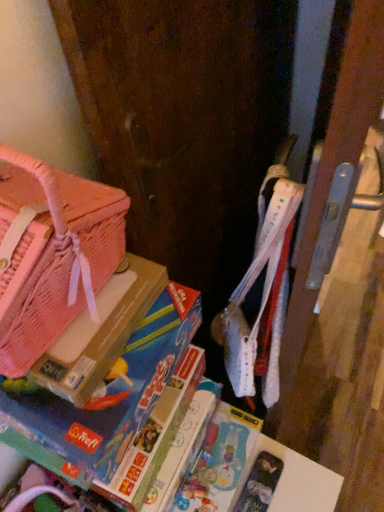
What do you see at coordinates (100, 332) in the screenshot? I see `pink mesh bag at left` at bounding box center [100, 332].

The height and width of the screenshot is (512, 384). Identify the location of pink woven handbag at left. (61, 256).

This screenshot has height=512, width=384. I want to click on pink mesh bag at left, so click(100, 332).

Which point is more forward, (26, 335) or (117, 280)?

The point (26, 335) is more forward.

Is pink woven handbag at left oriented towards pink mesh bag at left?

No, pink woven handbag at left is not oriented towards pink mesh bag at left.

Considering the relative sizes of pink woven handbag at left and pink mesh bag at left in the image provided, is pink woven handbag at left taller than pink mesh bag at left?

Yes, pink woven handbag at left is taller than pink mesh bag at left.

From the image's perspective, relative to pink mesh bag at left, is pink woven handbag at left above or below?

From the image's perspective, pink woven handbag at left appears above pink mesh bag at left.

From the image's perspective, is pink woven handbag at left beneath blue cardboard game at left?

No, from the image's perspective, pink woven handbag at left is not below blue cardboard game at left.

Considering the relative sizes of pink woven handbag at left and blue cardboard game at left in the image provided, is pink woven handbag at left smaller than blue cardboard game at left?

No, pink woven handbag at left is not smaller than blue cardboard game at left.

Is pink woven handbag at left taller or shorter than blue cardboard game at left?

Clearly, pink woven handbag at left is taller compared to blue cardboard game at left.

Can you confirm if pink woven handbag at left is wider than blue cardboard game at left?

Incorrect, the width of pink woven handbag at left does not surpass that of blue cardboard game at left.

Can you confirm if blue cardboard game at left is wider than pink woven handbag at left?

Yes, blue cardboard game at left is wider than pink woven handbag at left.

From a real-world perspective, between blue cardboard game at left and pink woven handbag at left, who is vertically lower?

blue cardboard game at left, from a real-world perspective.

Considering the relative positions of blue cardboard game at left and pink woven handbag at left in the image provided, is blue cardboard game at left to the right of pink woven handbag at left from the viewer's perspective?

Yes.

Based on their sizes in the image, would you say pink mesh bag at left is bigger or smaller than blue cardboard game at left?

In the image, pink mesh bag at left appears to be smaller than blue cardboard game at left.

From a real-world perspective, is pink mesh bag at left positioned above or below blue cardboard game at left?

pink mesh bag at left is above blue cardboard game at left.

In the scene shown: From the image's perspective, would you say pink mesh bag at left is positioned over blue cardboard game at left?

Yes, from the image's perspective, pink mesh bag at left is above blue cardboard game at left.

Is pink mesh bag at left inside or outside of blue cardboard game at left?

pink mesh bag at left is not enclosed by blue cardboard game at left.

From a real-world perspective, who is located higher, pink mesh bag at left or pink woven handbag at left?

pink woven handbag at left.

From the image's perspective, is pink mesh bag at left positioned above or below pink woven handbag at left?

pink mesh bag at left is situated lower than pink woven handbag at left in the image.

Can you confirm if pink mesh bag at left is smaller than pink woven handbag at left?

Correct, pink mesh bag at left occupies less space than pink woven handbag at left.

Identify the location of handbag that is on the left side of pink mesh bag at left. (61, 256).

Considering the sizes of objects blue cardboard game at left and pink mesh bag at left in the image provided, who is bigger, blue cardboard game at left or pink mesh bag at left?

With larger size is blue cardboard game at left.

Is blue cardboard game at left facing away from pink mesh bag at left?

blue cardboard game at left is not turned away from pink mesh bag at left.

Is blue cardboard game at left positioned beyond the bounds of pink mesh bag at left?

Yes.

Where is `handbag lying on the left of pink mesh bag at left`? handbag lying on the left of pink mesh bag at left is located at coordinates (61, 256).

This screenshot has height=512, width=384. What are the coordinates of `handbag in front of the blue cardboard game at left` in the screenshot? It's located at (61, 256).

Looking at the image, which one is located closer to blue cardboard game at left, pink mesh bag at left or pink woven handbag at left?

Based on the image, pink mesh bag at left appears to be nearer to blue cardboard game at left.

From the image, which object appears to be nearer to pink mesh bag at left, blue cardboard game at left or pink woven handbag at left?

blue cardboard game at left is positioned closer to the anchor pink mesh bag at left.

When comparing their distances from pink woven handbag at left, does pink mesh bag at left or blue cardboard game at left seem further?

blue cardboard game at left lies further to pink woven handbag at left than the other object.

Considering their positions, is pink woven handbag at left positioned further to pink mesh bag at left than blue cardboard game at left?

pink woven handbag at left is further to pink mesh bag at left.

Based on their spatial positions, is pink woven handbag at left or pink mesh bag at left closer to blue cardboard game at left?

Among the two, pink mesh bag at left is located nearer to blue cardboard game at left.

From the image, which object appears to be farther from pink woven handbag at left, blue cardboard game at left or pink mesh bag at left?

blue cardboard game at left is further to pink woven handbag at left.

In order to click on book positioned between pink woven handbag at left and pink mesh bag at left from near to far in this screenshot , I will do `click(108, 393)`.